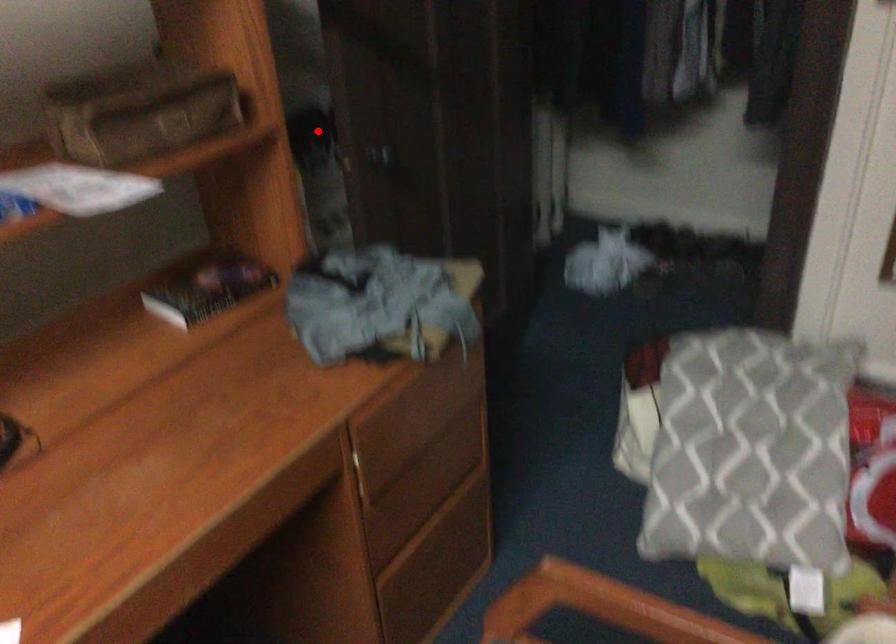
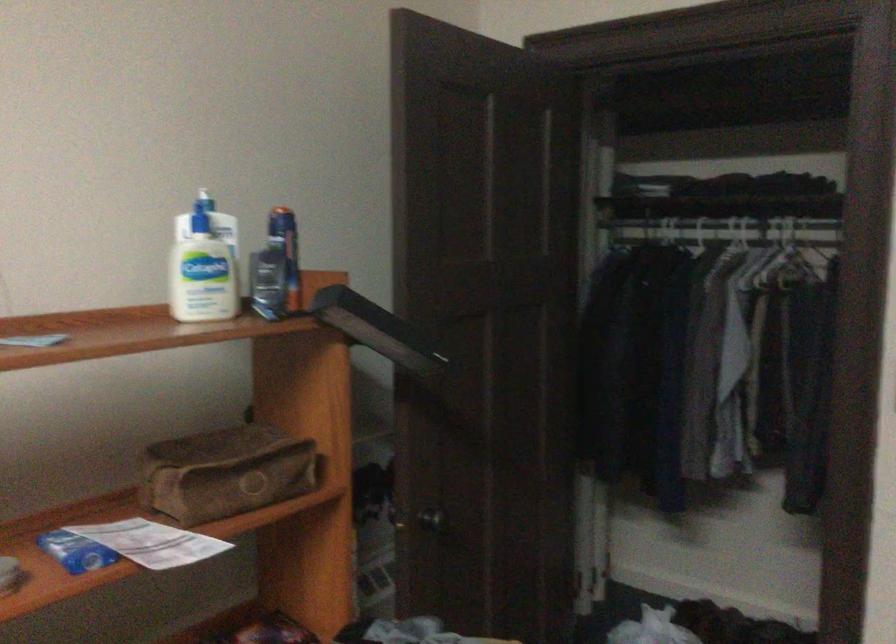
Find the pixel in the second image that matches the highlighted location in the first image.

(373, 491)